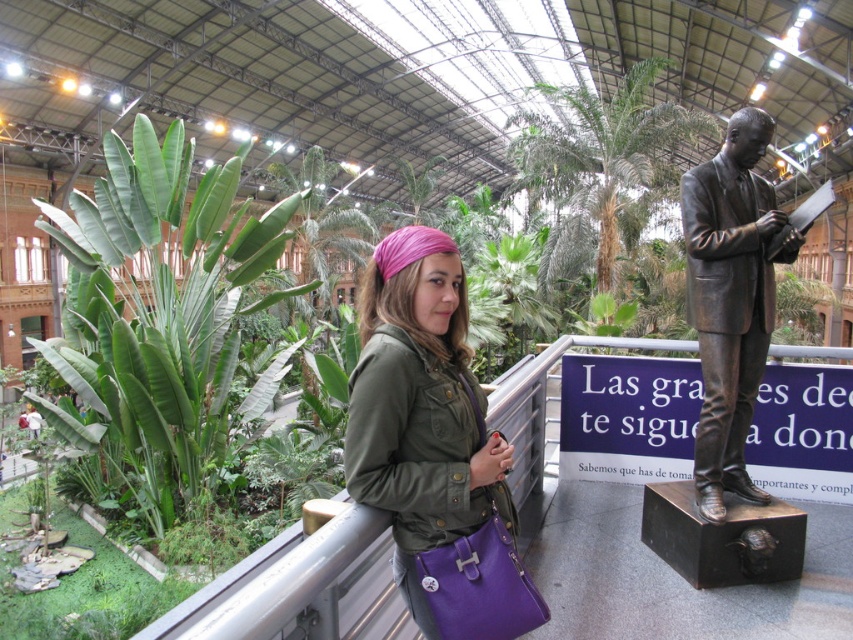
You are standing in the greenhouse and want to take a photo of the green leafy plant at left without the green leafy plant at lower left blocking the view. Is this possible?

The green leafy plant at lower left is behind the green leafy plant at left, so you can take a photo of the green leafy plant at left without obstruction from the green leafy plant at lower left.

You are a visitor in the greenhouse and want to take a photo of the bronze statue at right without the green leafy plant at lower left appearing in the background. Is this possible based on their positions?

Yes, since the bronze statue at right is in front of the green leafy plant at lower left, you can position yourself so that the statue blocks the view of the plant, thus excluding it from the photo background.